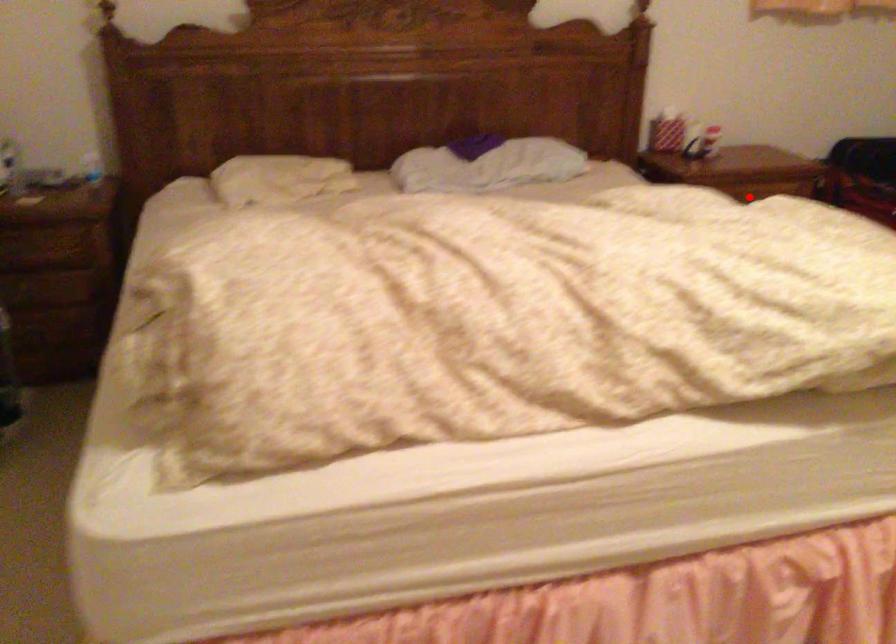
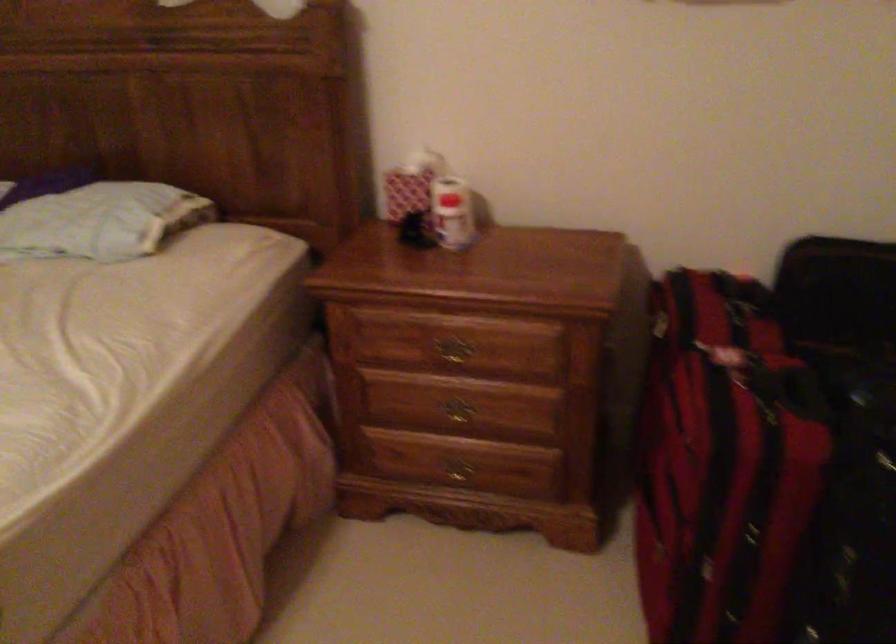
The point at the highlighted location is marked in the first image. Where is the corresponding point in the second image?

(452, 353)